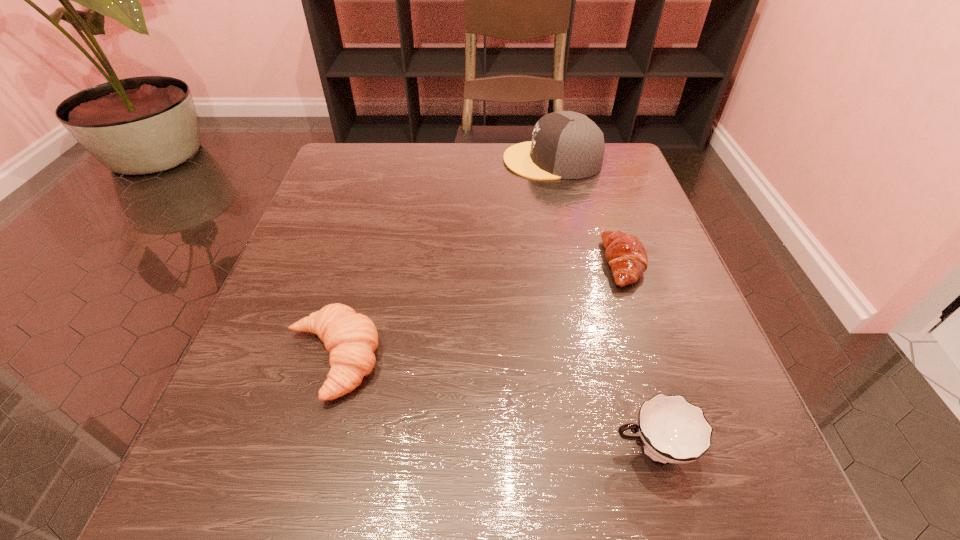
I want to click on crescent roll that is at the right edge, so click(625, 254).

The image size is (960, 540). In order to click on object present at the far right corner in this screenshot , I will do `click(565, 145)`.

Where is `object located in the near right corner section of the desktop`? object located in the near right corner section of the desktop is located at coordinates (672, 430).

The image size is (960, 540). I want to click on vacant space at the far edge of the desktop, so click(498, 170).

This screenshot has width=960, height=540. Find the location of `blank space at the near edge of the desktop`. blank space at the near edge of the desktop is located at coordinates (402, 502).

The image size is (960, 540). What are the coordinates of `vacant space at the left edge` in the screenshot? It's located at (285, 313).

The height and width of the screenshot is (540, 960). What are the coordinates of `free space at the right edge of the desktop` in the screenshot? It's located at (670, 249).

In the image, there is a desktop. Where is `vacant region at the far left corner`? This screenshot has width=960, height=540. vacant region at the far left corner is located at coordinates (397, 157).

This screenshot has height=540, width=960. What are the coordinates of `vacant space at the near left corner of the desktop` in the screenshot? It's located at (201, 527).

Identify the location of empty space between the taller crescent roll and the right crescent roll. (477, 312).